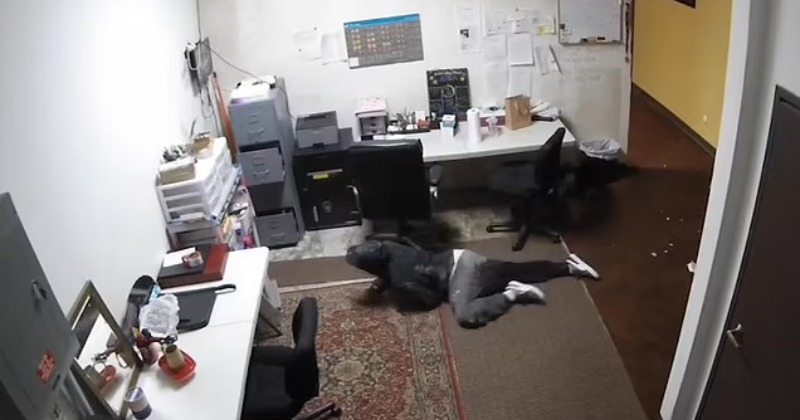
The image size is (800, 420). What are the coordinates of `wall` in the screenshot? It's located at (82, 139), (252, 40).